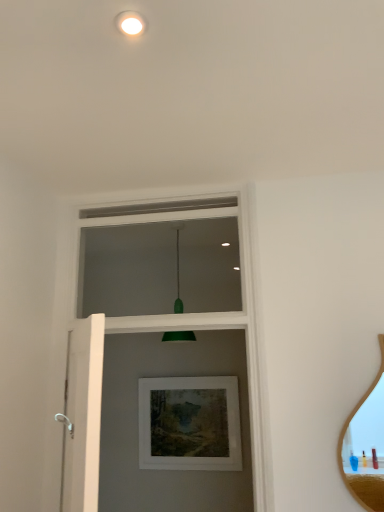
Measure the distance between white painted wood at upper center and camera.

white painted wood at upper center and camera are 5.93 feet apart.

Where is `wooden mirror at right`? wooden mirror at right is located at coordinates (365, 445).

From the image's perspective, would you say white painted wood at upper center is positioned over wooden mirror at right?

Yes, from the image's perspective, white painted wood at upper center is over wooden mirror at right.

Identify the location of window frame on the left side of wooden mirror at right. 190,313.

In the image, is white painted wood at upper center positioned in front of or behind wooden mirror at right?

Visually, white painted wood at upper center is located behind wooden mirror at right.

Which is more to the right, green matte droplight at upper center or matte white picture frame at center?

matte white picture frame at center.

How different are the orientations of green matte droplight at upper center and matte white picture frame at center in degrees?

3.07 degrees.

From a real-world perspective, between green matte droplight at upper center and matte white picture frame at center, who is vertically lower?

matte white picture frame at center, from a real-world perspective.

Considering the sizes of objects green matte droplight at upper center and matte white picture frame at center in the image provided, who is bigger, green matte droplight at upper center or matte white picture frame at center?

Bigger between the two is matte white picture frame at center.

At what (x,y) coordinates should I click in order to perform the action: click on window frame behind the white matte screen door at left. Please return your answer as a coordinate pair (x, y). This screenshot has width=384, height=512. Looking at the image, I should click on (190, 313).

From a real-world perspective, is white painted wood at upper center on top of white matte screen door at left?

Yes, from a real-world perspective, white painted wood at upper center is over white matte screen door at left

From the image's perspective, is white painted wood at upper center on white matte screen door at left?

Yes, from the image's perspective, white painted wood at upper center is over white matte screen door at left.

Which is behind, white painted wood at upper center or white matte screen door at left?

white painted wood at upper center is further away from the camera.

From the image's perspective, is green matte droplight at upper center over white painted wood at upper center?

Yes.

Does green matte droplight at upper center contain white painted wood at upper center?

No, white painted wood at upper center is not a part of green matte droplight at upper center.

Who is smaller, green matte droplight at upper center or white painted wood at upper center?

With smaller size is green matte droplight at upper center.

Are green matte droplight at upper center and white painted wood at upper center located far from each other?

That's right, there is a large distance between green matte droplight at upper center and white painted wood at upper center.

Which object is further away from the camera taking this photo, matte white picture frame at center or wooden mirror at right?

Result: matte white picture frame at center is more distant.

From the image's perspective, between matte white picture frame at center and wooden mirror at right, who is located below?

matte white picture frame at center, from the image's perspective.

How different are the orientations of matte white picture frame at center and wooden mirror at right in degrees?

0.186 degrees separate the facing orientations of matte white picture frame at center and wooden mirror at right.

Locate an element on the screen. droplight above the white matte screen door at left (from the image's perspective) is located at coordinates (130, 23).

Does white matte screen door at left touch green matte droplight at upper center?

No, white matte screen door at left is not in contact with green matte droplight at upper center.

Consider the image. How far apart are white matte screen door at left and green matte droplight at upper center?

They are 3.81 feet apart.

Who is bigger, white matte screen door at left or green matte droplight at upper center?

With larger size is white matte screen door at left.

Which is less distant, (126,28) or (77,439)?

Point (126,28)

What are the coordinates of `screen door below the green matte droplight at upper center (from the image's perspective)` in the screenshot? It's located at (82, 415).

Can white matte screen door at left be found inside green matte droplight at upper center?

Definitely not — white matte screen door at left is not inside green matte droplight at upper center.

Can you confirm if green matte droplight at upper center is bigger than white matte screen door at left?

Actually, green matte droplight at upper center might be smaller than white matte screen door at left.

The height and width of the screenshot is (512, 384). Identify the location of window frame that appears behind the wooden mirror at right. (190, 313).

Locate an element on the screen. Image resolution: width=384 pixels, height=512 pixels. droplight that is on the left side of matte white picture frame at center is located at coordinates (130, 23).

Consider the image. When comparing their distances from white matte screen door at left, does green matte droplight at upper center or white painted wood at upper center seem closer?

Among the two, white painted wood at upper center is located nearer to white matte screen door at left.

Looking at the image, which one is located closer to white painted wood at upper center, white matte screen door at left or matte white picture frame at center?

white matte screen door at left.

Looking at the image, which one is located further to green matte droplight at upper center, wooden mirror at right or white painted wood at upper center?

The object further to green matte droplight at upper center is wooden mirror at right.

Which object lies nearer to the anchor point matte white picture frame at center, white painted wood at upper center or green matte droplight at upper center?

Based on the image, white painted wood at upper center appears to be nearer to matte white picture frame at center.

When comparing their distances from wooden mirror at right, does matte white picture frame at center or green matte droplight at upper center seem closer?

matte white picture frame at center is closer to wooden mirror at right.

Considering their positions, is white painted wood at upper center positioned further to green matte droplight at upper center than white matte screen door at left?

white matte screen door at left lies further to green matte droplight at upper center than the other object.

In the scene shown: When comparing their distances from wooden mirror at right, does white painted wood at upper center or white matte screen door at left seem further?

Based on the image, white matte screen door at left appears to be further to wooden mirror at right.

Looking at the image, which one is located further to green matte droplight at upper center, white painted wood at upper center or wooden mirror at right?

wooden mirror at right.

Identify the location of window frame between wooden mirror at right and matte white picture frame at center along the z-axis. (190, 313).

Image resolution: width=384 pixels, height=512 pixels. Identify the location of window frame between green matte droplight at upper center and white matte screen door at left in the vertical direction. coord(190,313).

At what (x,y) coordinates should I click in order to perform the action: click on mirror between green matte droplight at upper center and matte white picture frame at center in the up-down direction. Please return your answer as a coordinate pair (x, y). The image size is (384, 512). Looking at the image, I should click on [x=365, y=445].

I want to click on screen door between green matte droplight at upper center and wooden mirror at right from top to bottom, so click(x=82, y=415).